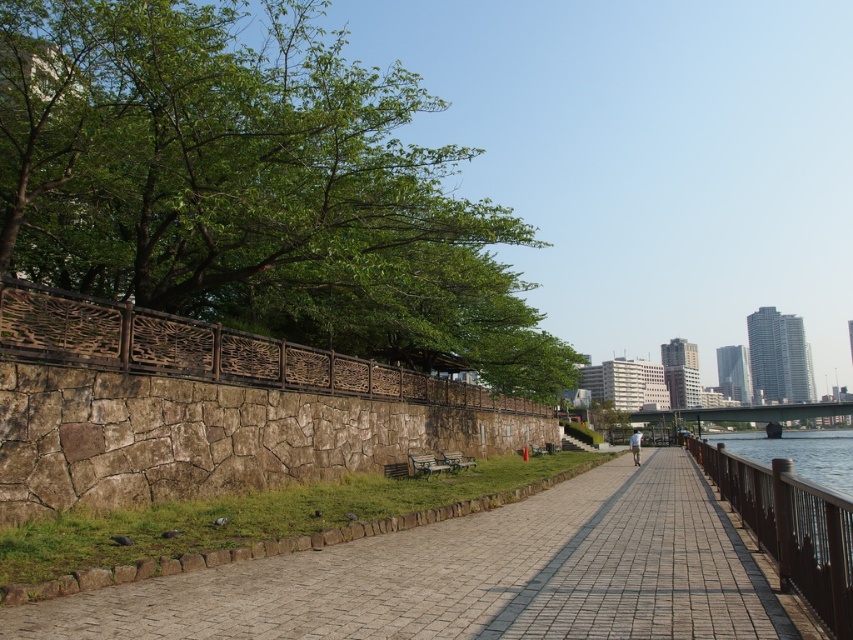
Does brick paved walkway at center have a smaller size compared to paved stone walkway at center?

Yes, brick paved walkway at center is smaller than paved stone walkway at center.

Can you confirm if brick paved walkway at center is positioned above paved stone walkway at center?

Yes.

Which is in front, point (218, 600) or point (618, 500)?

Point (218, 600) is more forward.

Locate an element on the screen. Image resolution: width=853 pixels, height=640 pixels. brick paved walkway at center is located at coordinates (477, 577).

Is green leafy tree at upper left thinner than paved stone walkway at center?

No.

Which is more to the right, green leafy tree at upper left or paved stone walkway at center?

Positioned to the right is paved stone walkway at center.

Which is in front, point (361, 202) or point (657, 477)?

Point (361, 202) is in front.

Where is `green leafy tree at upper left`? The width and height of the screenshot is (853, 640). green leafy tree at upper left is located at coordinates (253, 188).

Who is taller, paved stone walkway at center or brown wooden railing at right?

With more height is brown wooden railing at right.

Can you confirm if paved stone walkway at center is positioned above brown wooden railing at right?

Yes, paved stone walkway at center is above brown wooden railing at right.

This screenshot has width=853, height=640. Describe the element at coordinates (648, 570) in the screenshot. I see `paved stone walkway at center` at that location.

Locate an element on the screen. The image size is (853, 640). paved stone walkway at center is located at coordinates (648, 570).